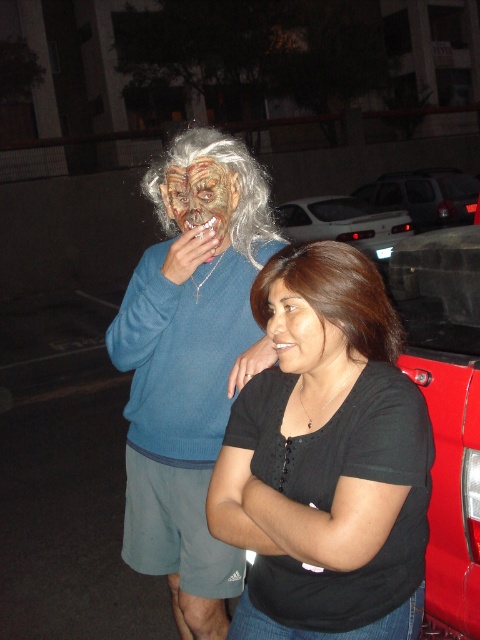
You are a photographer setting up a lighting rig for a portrait. You need to ensure that the black matte shirt at center and the matte blue sweater at center are both visible in the frame. Which object should you focus on first to ensure proper exposure, considering their positions?

The black matte shirt at center is positioned under the matte blue sweater at center, so you should focus on the matte blue sweater at center first to ensure it is properly exposed before adjusting for the black matte shirt at center underneath.

You are standing in front of the two people in the image. Which of the two points, point (x=275, y=307) or point (x=143, y=408), is closer to you?

Point (x=275, y=307) is closer to the viewer than point (x=143, y=408).

You are a costume designer preparing for a Halloween party. You have two costume options available to you, the black matte shirt at center and the matte blue sweater at center. Which costume option is more formfitting and less bulky?

The black matte shirt at center is thinner than the matte blue sweater at center, so the black matte shirt at center is more formfitting and less bulky.